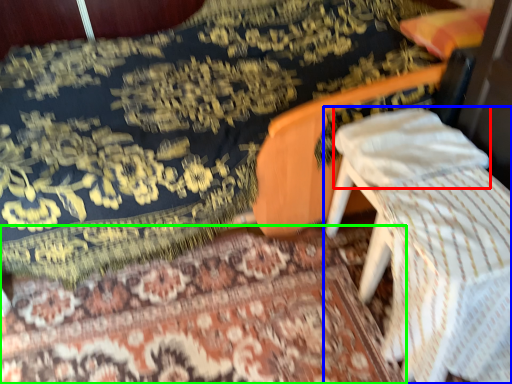
Question: Based on their relative distances, which object is farther from pillow (highlighted by a red box)? Choose from furniture (highlighted by a blue box) and mat (highlighted by a green box).

Choices:
 (A) furniture
 (B) mat

Answer: (B)